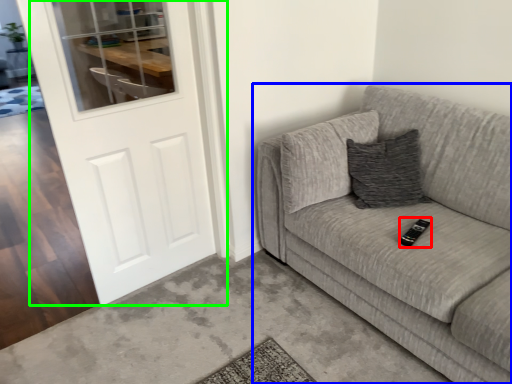
Question: Which object is the farthest from remote (highlighted by a red box)? Choose among these: studio couch (highlighted by a blue box) or door (highlighted by a green box).

Choices:
 (A) studio couch
 (B) door

Answer: (B)